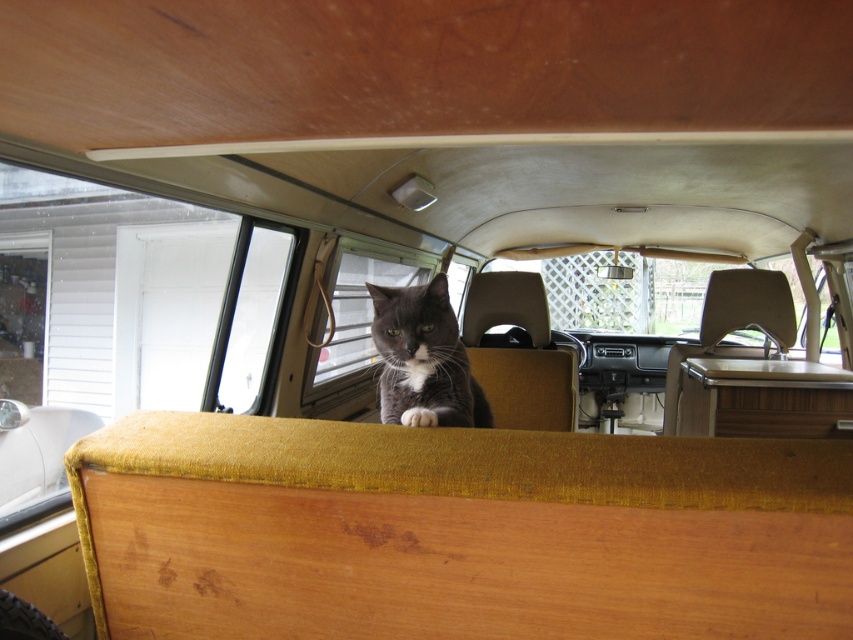
Between clear glass window at center and transparent glass window at left, which one is positioned higher?

clear glass window at center is above.

Is clear glass window at center below transparent glass window at left?

No, clear glass window at center is not below transparent glass window at left.

Which is in front, point (360, 356) or point (10, 352)?

Positioned in front is point (360, 356).

Identify the location of clear glass window at center. The height and width of the screenshot is (640, 853). (357, 314).

You are a GUI agent. You are given a task and a screenshot of the screen. Output one action in this format:
    pyautogui.click(x=<x>, y=<y>)
    Task: Click on the gray fur cat at center
    This screenshot has height=640, width=853.
    Given the screenshot: What is the action you would take?
    pyautogui.click(x=422, y=358)

Does gray fur cat at center appear over transparent glass window at left?

Incorrect, gray fur cat at center is not positioned above transparent glass window at left.

Which is behind, point (410, 408) or point (45, 264)?

The point (45, 264) is behind.

Identify the location of gray fur cat at center. Image resolution: width=853 pixels, height=640 pixels. (422, 358).

Who is more forward, [461,424] or [318,332]?

Point [461,424] is more forward.

Who is higher up, gray fur cat at center or clear glass window at center?

clear glass window at center is above.

Between point (451, 323) and point (364, 296), which one is positioned behind?

The point (364, 296) is more distant.

Locate an element on the screen. This screenshot has width=853, height=640. gray fur cat at center is located at coordinates click(422, 358).